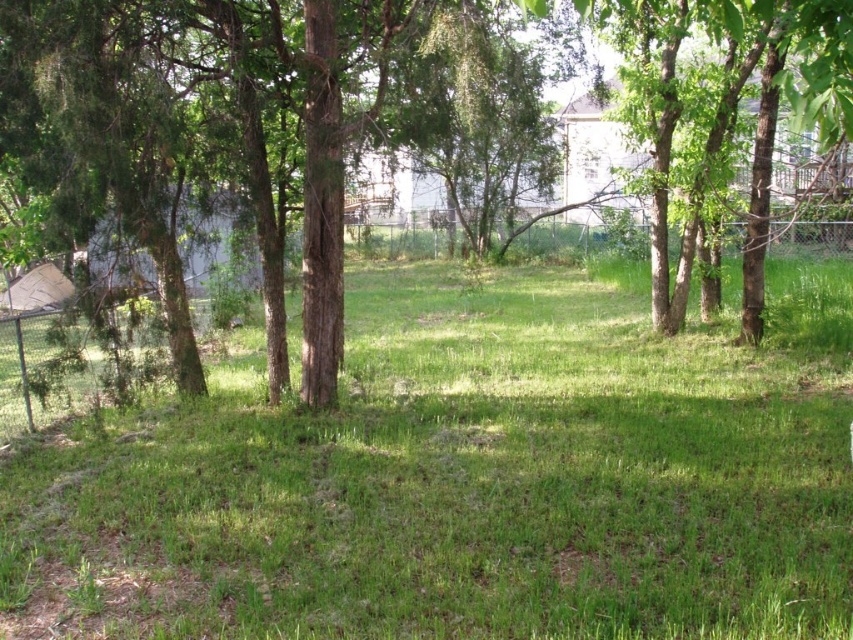
You are a gardener who wants to plant a new flowerbed in the backyard. You notice the green grassy at center and the green leafy tree at center. Which object is located above the other?

The green leafy tree at center is above the green grassy at center, as the grassy area is situated below the tree.

You are a gardener planning to water the green grassy at center and the green leafy tree at center. Your watering can has a range of 5 meters. Can you water both without moving closer? Please explain your reasoning.

The green grassy at center is 5.65 meters away from the green leafy tree at center. Since the watering can has a 5 meter range, you cannot reach both without moving closer because the distance between them exceeds the can range.